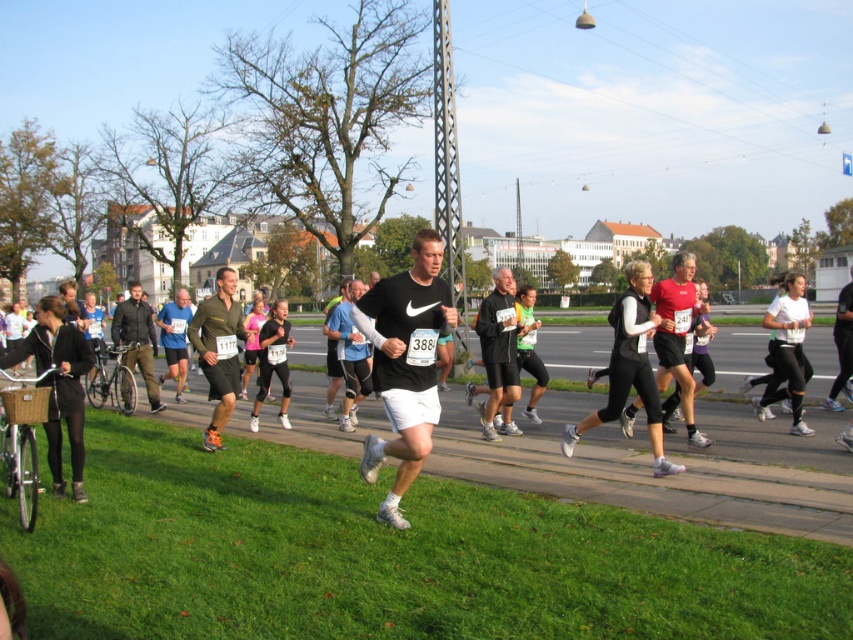
Question: Can you confirm if matte black jacket at left is bigger than matte black shirt at center?

Choices:
 (A) no
 (B) yes

Answer: (B)

Question: Is matte black jacket at left thinner than matte black shirt at center?

Choices:
 (A) yes
 (B) no

Answer: (B)

Question: Which of the following is the closest to the observer?

Choices:
 (A) (508, 284)
 (B) (422, 300)

Answer: (B)

Question: Which point is closer to the camera?

Choices:
 (A) (160, 330)
 (B) (224, 298)
 (C) (126, 362)

Answer: (B)

Question: Does black matte shorts at center appear on the left side of matte blue shirt at center?

Choices:
 (A) yes
 (B) no

Answer: (B)

Question: Which point appears closest to the camera in this image?

Choices:
 (A) (172, 308)
 (B) (509, 307)
 (C) (149, 412)
 (D) (430, 362)

Answer: (D)